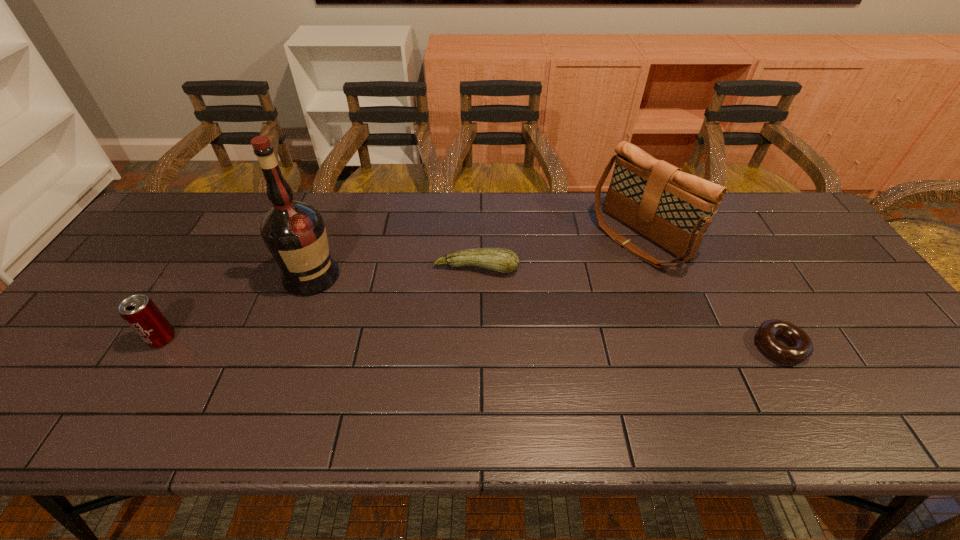
The width and height of the screenshot is (960, 540). What are the coordinates of `free space between the fourth object from left to right and the third object from right to left` in the screenshot? It's located at (559, 253).

Locate an element on the screen. free space between the zucchini and the beer can is located at coordinates (320, 303).

The height and width of the screenshot is (540, 960). Find the location of `vacant area that lies between the second tallest object and the doughnut`. vacant area that lies between the second tallest object and the doughnut is located at coordinates click(x=710, y=292).

Locate an element on the screen. Image resolution: width=960 pixels, height=540 pixels. free point between the zucchini and the rightmost object is located at coordinates (628, 307).

You are a GUI agent. You are given a task and a screenshot of the screen. Output one action in this format:
    pyautogui.click(x=<x>, y=<y>)
    Task: Click on the free spot between the third object from left to right and the shortest object
    The height and width of the screenshot is (540, 960).
    Given the screenshot: What is the action you would take?
    pyautogui.click(x=628, y=307)

Locate an element on the screen. This screenshot has width=960, height=540. empty space that is in between the third tallest object and the zucchini is located at coordinates (320, 303).

Choose which object is the fourth nearest neighbor to the second object from right to left. Please provide its 2D coordinates. Your answer should be formatted as a tuple, i.e. [(x, y)], where the tuple contains the x and y coordinates of a point satisfying the conditions above.

[(142, 315)]

Identify which object is the third closest to the shortest object. Please provide its 2D coordinates. Your answer should be formatted as a tuple, i.e. [(x, y)], where the tuple contains the x and y coordinates of a point satisfying the conditions above.

[(294, 232)]

This screenshot has height=540, width=960. I want to click on vacant region that satisfies the following two spatial constraints: 1. on the back side of the beer can; 2. on the left side of the tallest object, so click(201, 276).

I want to click on vacant space that satisfies the following two spatial constraints: 1. on the back side of the zucchini; 2. on the left side of the shoulder bag, so click(477, 238).